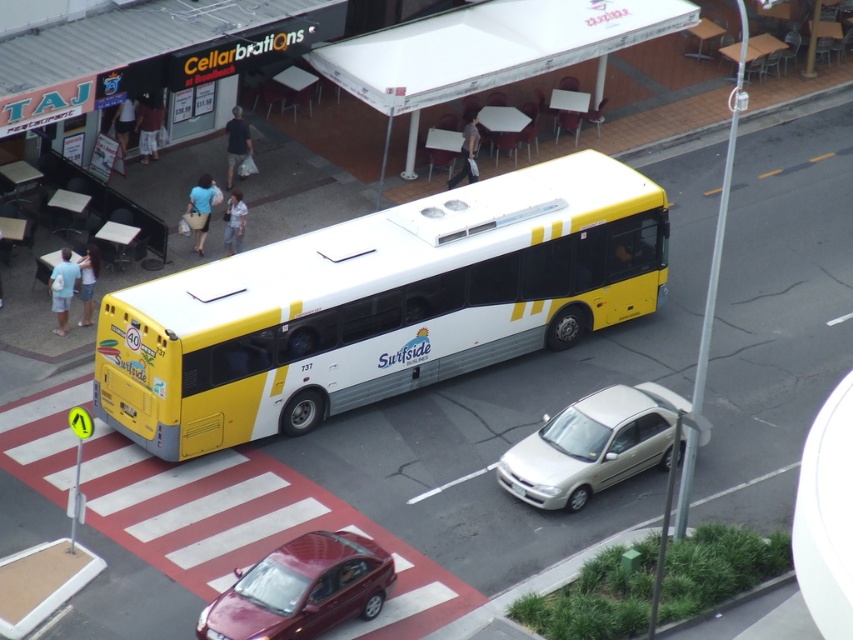
Question: Which object is positioned closest to the silver metallic sedan at center-right?

Choices:
 (A) shiny maroon sedan at lower center
 (B) white fabric canopy at upper center
 (C) yellow matte bus at center

Answer: (C)

Question: Does yellow matte bus at center have a lesser width compared to shiny maroon sedan at lower center?

Choices:
 (A) yes
 (B) no

Answer: (B)

Question: Which object is the closest to the white fabric canopy at upper center?

Choices:
 (A) yellow matte bus at center
 (B) shiny maroon sedan at lower center
 (C) silver metallic sedan at center-right

Answer: (A)

Question: Which object appears farthest from the camera in this image?

Choices:
 (A) yellow matte bus at center
 (B) white fabric canopy at upper center
 (C) silver metallic sedan at center-right
 (D) shiny maroon sedan at lower center

Answer: (B)

Question: Can you confirm if white fabric canopy at upper center is wider than shiny maroon sedan at lower center?

Choices:
 (A) yes
 (B) no

Answer: (A)

Question: Can you confirm if yellow matte bus at center is wider than shiny maroon sedan at lower center?

Choices:
 (A) yes
 (B) no

Answer: (A)